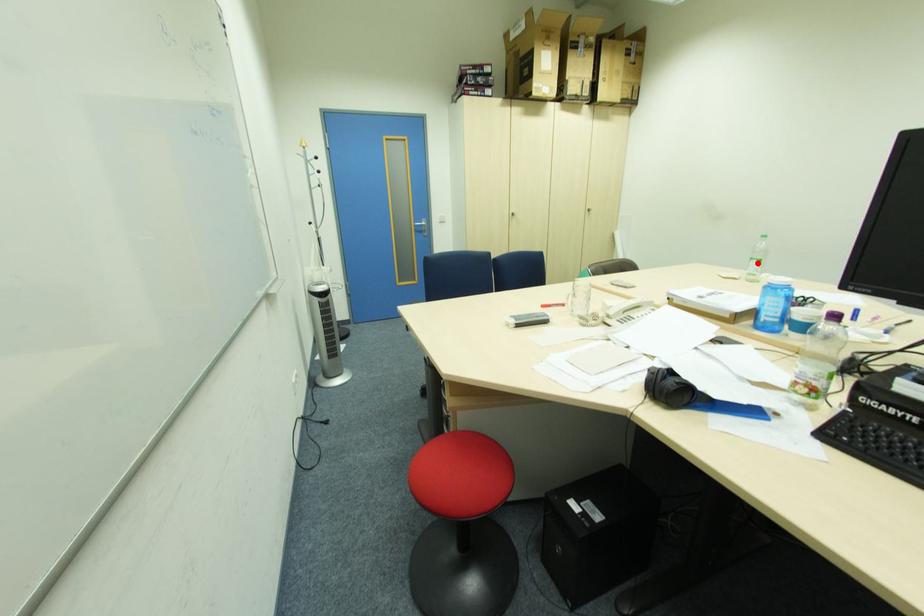
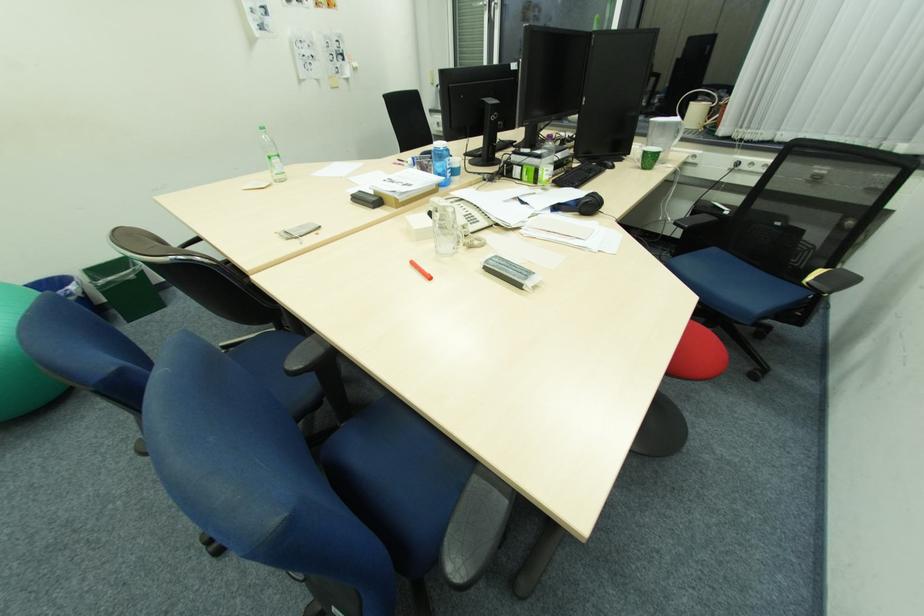
Locate, in the second image, the point that corresponds to the highlighted location in the first image.

(280, 161)